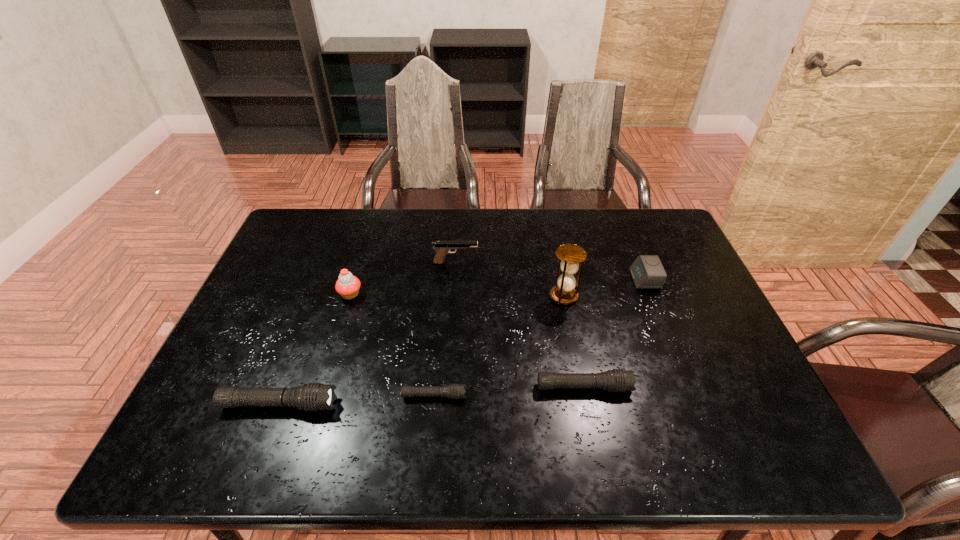
You are a GUI agent. You are given a task and a screenshot of the screen. Output one action in this format:
    pyautogui.click(x=<x>, y=<y>)
    Task: Click on the free space between the alarm clock and the cupcake
    Image resolution: width=960 pixels, height=540 pixels.
    Given the screenshot: What is the action you would take?
    pyautogui.click(x=497, y=287)

Image resolution: width=960 pixels, height=540 pixels. In order to click on vacant space in between the pistol and the rightmost flashlight in this screenshot , I will do `click(519, 325)`.

The height and width of the screenshot is (540, 960). I want to click on free space between the pistol and the sixth tallest object, so click(519, 325).

Where is `free point between the cupcake and the shortest object`? Image resolution: width=960 pixels, height=540 pixels. free point between the cupcake and the shortest object is located at coordinates (393, 345).

Identify the location of free point between the cupcake and the pistol. This screenshot has width=960, height=540. (403, 278).

Find the location of a particular element. The height and width of the screenshot is (540, 960). free spot between the shortest object and the cupcake is located at coordinates click(x=393, y=345).

Find the location of a particular element. empty location between the hourglass and the cupcake is located at coordinates (457, 295).

This screenshot has width=960, height=540. What are the coordinates of `vacant space in between the hourglass and the shortest object` in the screenshot? It's located at (499, 346).

Locate an element on the screen. the closest object to the leftmost flashlight is located at coordinates (454, 391).

At what (x,y) coordinates should I click in order to perform the action: click on object identified as the closest to the second flashlight from left to right. Please return your answer as a coordinate pair (x, y). The image size is (960, 540). Looking at the image, I should click on (313, 396).